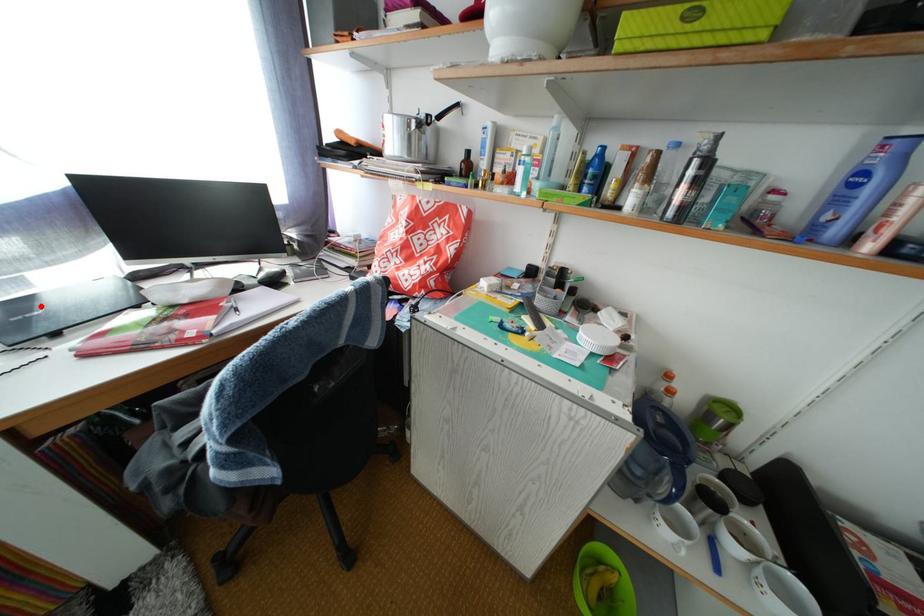
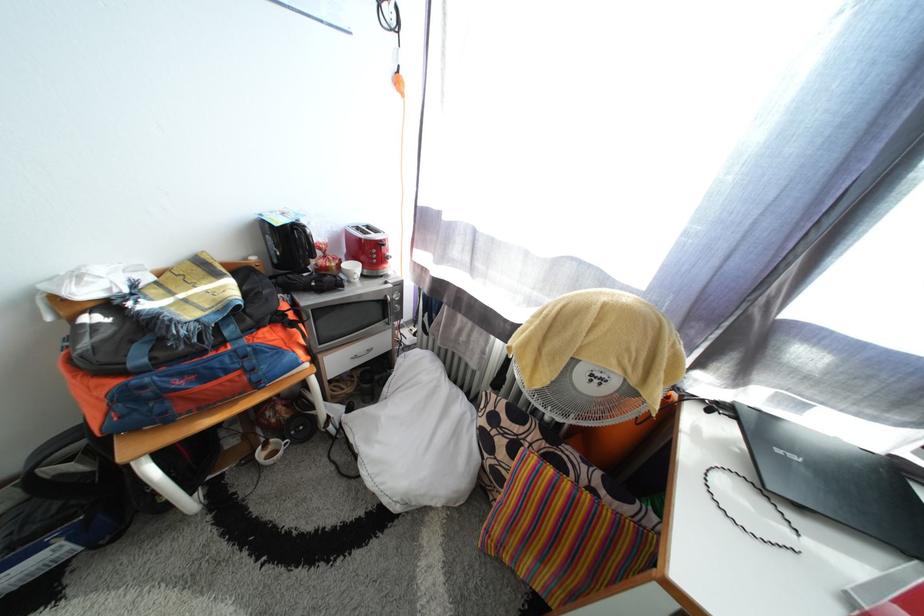
Question: I am providing you with two images of the same scene from different viewpoints. In image1, a red point is highlighted. Considering the same 3D point in image2, which of the following is correct?

Choices:
 (A) It is closer
 (B) It is farther

Answer: (A)